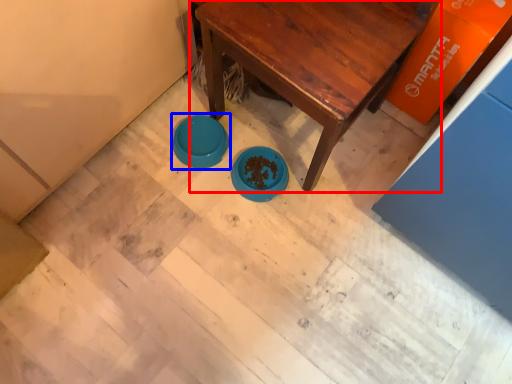
Question: Among these objects, which one is nearest to the camera, table (highlighted by a red box) or basin (highlighted by a blue box)?

Choices:
 (A) table
 (B) basin

Answer: (A)